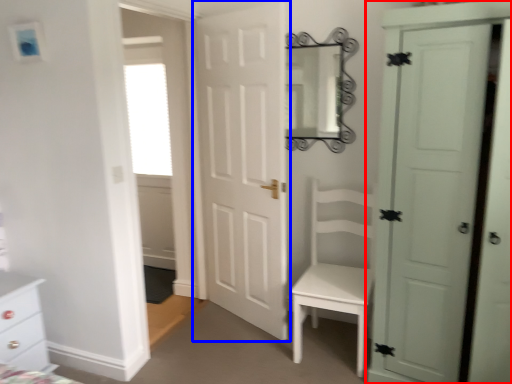
Question: Which object appears closest to the camera in this image, door (highlighted by a red box) or door (highlighted by a blue box)?

Choices:
 (A) door
 (B) door

Answer: (A)